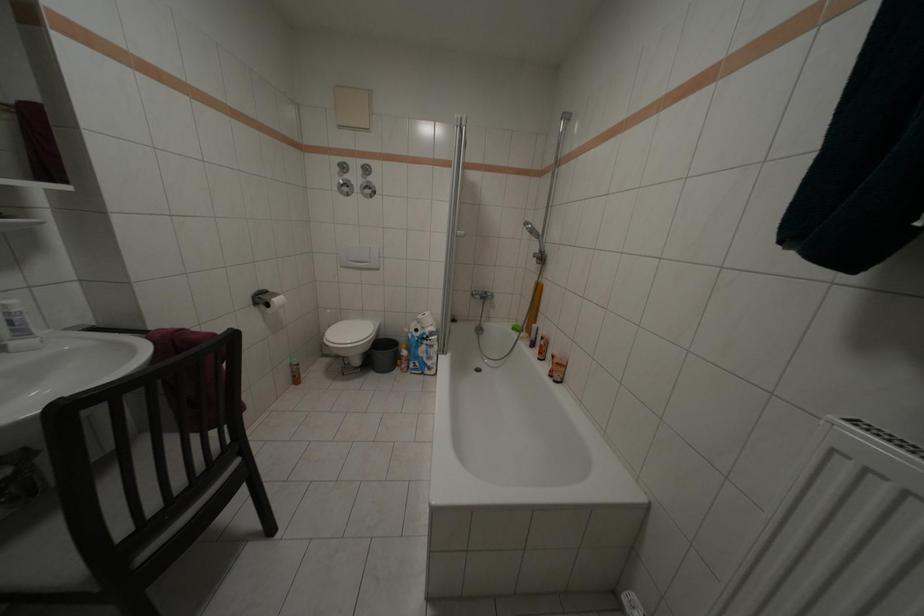
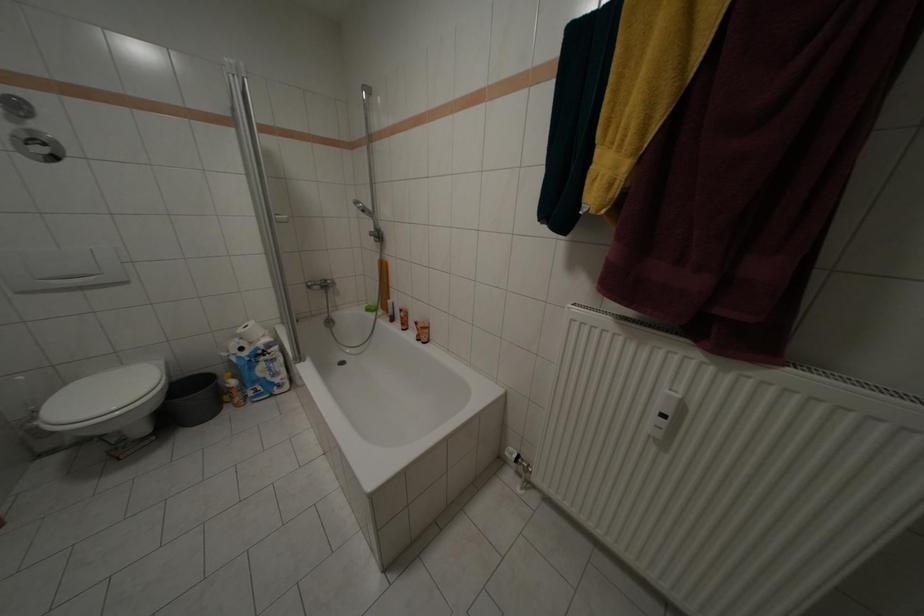
Question: The camera is either moving clockwise (left) or counter-clockwise (right) around the object. The first image is from the beginning of the video and the second image is from the end. Is the camera moving left or right when shooting the video?

Choices:
 (A) Left
 (B) Right

Answer: (A)